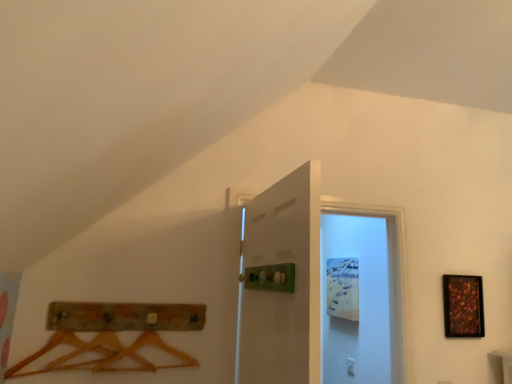
Question: From a real-world perspective, is white matte door at center, arranged as the second door when viewed from the front, above or below shiny metallic picture frame at right?

Choices:
 (A) above
 (B) below

Answer: (A)

Question: Choose the correct answer: Is white matte door at center, which is the first door from back to front, inside shiny metallic picture frame at right or outside it?

Choices:
 (A) inside
 (B) outside

Answer: (B)

Question: Based on their relative distances, which object is nearer to the white matte door at center, which is the first door from back to front?

Choices:
 (A) shiny metallic picture frame at right
 (B) white matte door at center, positioned as the 2th door in back-to-front order

Answer: (A)

Question: Considering the real-world distances, which object is farthest from the white matte door at center, arranged as the second door when viewed from the front?

Choices:
 (A) shiny metallic picture frame at right
 (B) white matte door at center, the 1th door from the front

Answer: (B)